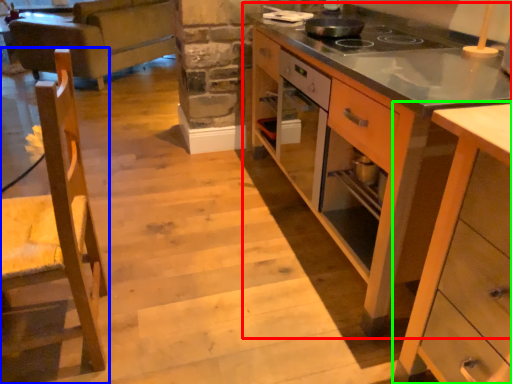
Question: Which is farther away from cabinetry (highlighted by a red box)? chair (highlighted by a blue box) or cabinetry (highlighted by a green box)?

Choices:
 (A) chair
 (B) cabinetry

Answer: (A)